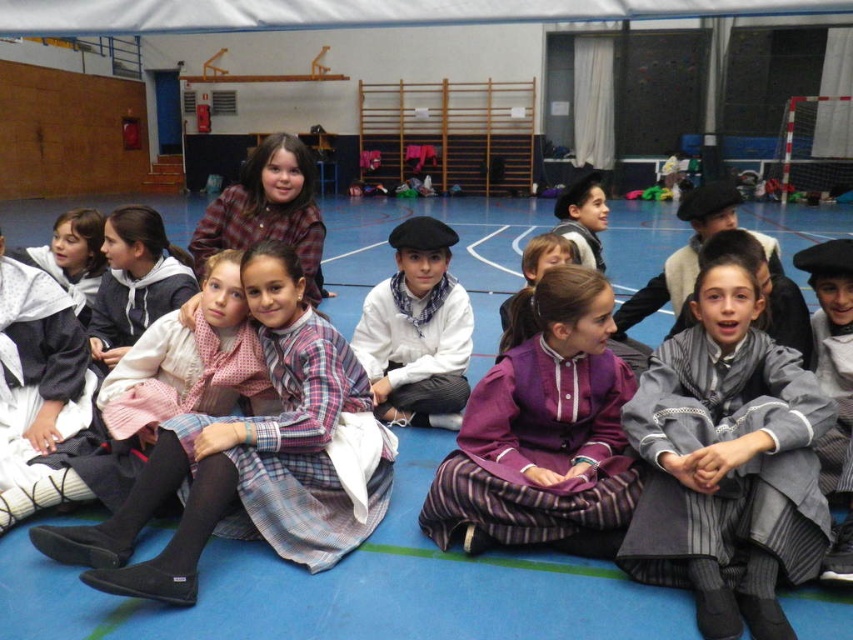
You are a photographer trying to capture a clear shot of the purple satin dress at center without the plaid fabric dress at center blocking it. What should you do?

Move your camera position to the side so that the plaid fabric dress at center is no longer directly in front of the purple satin dress at center, allowing you to capture the purple satin dress at center clearly.

Looking at this image, you are a photographer setting up for a group photo in the gymnasium. You need to ensure all children are visible. The children are wearing a white matte shirt at center and a plaid fabric shirt at upper center. Which child should you position closer to the camera to avoid being obscured by another child?

The plaid fabric shirt at upper center should be positioned closer to the camera because it is shorter than the white matte shirt at center, which is taller and could potentially block the view of the shorter child.